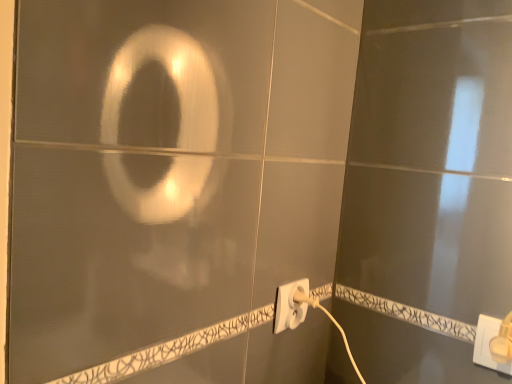
The width and height of the screenshot is (512, 384). What do you see at coordinates (488, 344) in the screenshot?
I see `white plastic power plug at lower right, the first power plugs and sockets positioned from the front` at bounding box center [488, 344].

Identify the location of white plastic power plug at lower right, positioned as the second power plugs and sockets in back-to-front order. (488, 344).

The image size is (512, 384). What do you see at coordinates (290, 305) in the screenshot?
I see `white plastic power plug at lower center, positioned as the second power plugs and sockets in right-to-left order` at bounding box center [290, 305].

You are a GUI agent. You are given a task and a screenshot of the screen. Output one action in this format:
    pyautogui.click(x=<x>, y=<y>)
    Task: Click on the white plastic power plug at lower center, the first power plugs and sockets in the left-to-right sequence
    
    Given the screenshot: What is the action you would take?
    [290, 305]

Locate an element on the screen. This screenshot has width=512, height=384. white plastic power plug at lower right, the second power plugs and sockets positioned from the left is located at coordinates (488, 344).

Would you say white plastic power plug at lower center, arranged as the second power plugs and sockets when viewed from the front, is to the left or to the right of white plastic power plug at lower right, acting as the first power plugs and sockets starting from the right, in the picture?

In the image, white plastic power plug at lower center, arranged as the second power plugs and sockets when viewed from the front, appears on the left side of white plastic power plug at lower right, acting as the first power plugs and sockets starting from the right.

Is white plastic power plug at lower center, positioned as the second power plugs and sockets in right-to-left order, in front of white plastic power plug at lower right, positioned as the second power plugs and sockets in back-to-front order?

That is False.

Is point (287, 309) less distant than point (490, 322)?

No, it is behind (490, 322).

From the image's perspective, does white plastic power plug at lower center, positioned as the second power plugs and sockets in right-to-left order, appear higher than white plastic power plug at lower right, the first power plugs and sockets positioned from the front?

Yes, from the image's perspective, white plastic power plug at lower center, positioned as the second power plugs and sockets in right-to-left order, is above white plastic power plug at lower right, the first power plugs and sockets positioned from the front.

From a real-world perspective, is white plastic power plug at lower center, the first power plugs and sockets in the left-to-right sequence, above or below white plastic power plug at lower right, positioned as the second power plugs and sockets in back-to-front order?

In terms of real-world spatial position, white plastic power plug at lower center, the first power plugs and sockets in the left-to-right sequence, is above white plastic power plug at lower right, positioned as the second power plugs and sockets in back-to-front order.

Which object is thinner, white plastic power plug at lower center, positioned as the second power plugs and sockets in right-to-left order, or white plastic power plug at lower right, positioned as the second power plugs and sockets in back-to-front order?

white plastic power plug at lower right, positioned as the second power plugs and sockets in back-to-front order.

Between white plastic power plug at lower center, which is the first power plugs and sockets from back to front, and white plastic power plug at lower right, acting as the first power plugs and sockets starting from the right, which one has more height?

With more height is white plastic power plug at lower center, which is the first power plugs and sockets from back to front.

Who is smaller, white plastic power plug at lower center, positioned as the second power plugs and sockets in right-to-left order, or white plastic power plug at lower right, the second power plugs and sockets positioned from the left?

Smaller between the two is white plastic power plug at lower right, the second power plugs and sockets positioned from the left.

Which is correct: white plastic power plug at lower center, the first power plugs and sockets in the left-to-right sequence, is inside white plastic power plug at lower right, the second power plugs and sockets positioned from the left, or outside of it?

white plastic power plug at lower center, the first power plugs and sockets in the left-to-right sequence, is outside white plastic power plug at lower right, the second power plugs and sockets positioned from the left.

Is white plastic power plug at lower center, which is the first power plugs and sockets from back to front, beside white plastic power plug at lower right, the first power plugs and sockets positioned from the front?

white plastic power plug at lower center, which is the first power plugs and sockets from back to front, and white plastic power plug at lower right, the first power plugs and sockets positioned from the front, are not in contact.

Is white plastic power plug at lower center, arranged as the second power plugs and sockets when viewed from the front, turned away from white plastic power plug at lower right, positioned as the second power plugs and sockets in back-to-front order?

white plastic power plug at lower center, arranged as the second power plugs and sockets when viewed from the front, is not turned away from white plastic power plug at lower right, positioned as the second power plugs and sockets in back-to-front order.

How much distance is there between white plastic power plug at lower center, which is the first power plugs and sockets from back to front, and white plastic power plug at lower right, the second power plugs and sockets positioned from the left?

white plastic power plug at lower center, which is the first power plugs and sockets from back to front, and white plastic power plug at lower right, the second power plugs and sockets positioned from the left, are 12.11 inches apart.

Locate an element on the screen. The image size is (512, 384). power plugs and sockets that is behind the white plastic power plug at lower right, the first power plugs and sockets positioned from the front is located at coordinates (290, 305).

Which object is positioned more to the right, white plastic power plug at lower right, acting as the first power plugs and sockets starting from the right, or white plastic power plug at lower center, which is the first power plugs and sockets from back to front?

Positioned to the right is white plastic power plug at lower right, acting as the first power plugs and sockets starting from the right.

Relative to white plastic power plug at lower center, positioned as the second power plugs and sockets in right-to-left order, is white plastic power plug at lower right, the first power plugs and sockets positioned from the front, in front or behind?

white plastic power plug at lower right, the first power plugs and sockets positioned from the front, is positioned closer to the viewer than white plastic power plug at lower center, positioned as the second power plugs and sockets in right-to-left order.

Is point (501, 371) closer to camera compared to point (278, 320)?

Yes, point (501, 371) is closer to viewer.

From the image's perspective, would you say white plastic power plug at lower right, acting as the first power plugs and sockets starting from the right, is positioned over white plastic power plug at lower center, which is the first power plugs and sockets from back to front?

No, from the image's perspective, white plastic power plug at lower right, acting as the first power plugs and sockets starting from the right, is not over white plastic power plug at lower center, which is the first power plugs and sockets from back to front.

From a real-world perspective, is white plastic power plug at lower right, acting as the first power plugs and sockets starting from the right, positioned above or below white plastic power plug at lower center, positioned as the second power plugs and sockets in right-to-left order?

white plastic power plug at lower right, acting as the first power plugs and sockets starting from the right, is situated lower than white plastic power plug at lower center, positioned as the second power plugs and sockets in right-to-left order, in the real world.

Which of these two, white plastic power plug at lower right, the second power plugs and sockets positioned from the left, or white plastic power plug at lower center, which is the first power plugs and sockets from back to front, is wider?

white plastic power plug at lower center, which is the first power plugs and sockets from back to front.

Does white plastic power plug at lower right, acting as the first power plugs and sockets starting from the right, have a lesser height compared to white plastic power plug at lower center, which is the first power plugs and sockets from back to front?

Yes, white plastic power plug at lower right, acting as the first power plugs and sockets starting from the right, is shorter than white plastic power plug at lower center, which is the first power plugs and sockets from back to front.

Based on the photo, which of these two, white plastic power plug at lower right, the first power plugs and sockets positioned from the front, or white plastic power plug at lower center, arranged as the second power plugs and sockets when viewed from the front, is smaller?

white plastic power plug at lower right, the first power plugs and sockets positioned from the front.

Is white plastic power plug at lower center, the first power plugs and sockets in the left-to-right sequence, surrounded by white plastic power plug at lower right, the second power plugs and sockets positioned from the left?

That's incorrect, white plastic power plug at lower center, the first power plugs and sockets in the left-to-right sequence, is not inside white plastic power plug at lower right, the second power plugs and sockets positioned from the left.

Based on the photo, can you see white plastic power plug at lower right, the second power plugs and sockets positioned from the left, touching white plastic power plug at lower center, arranged as the second power plugs and sockets when viewed from the front?

white plastic power plug at lower right, the second power plugs and sockets positioned from the left, and white plastic power plug at lower center, arranged as the second power plugs and sockets when viewed from the front, are clearly separated.

Is white plastic power plug at lower right, positioned as the second power plugs and sockets in back-to-front order, turned away from white plastic power plug at lower center, the first power plugs and sockets in the left-to-right sequence?

No, white plastic power plug at lower right, positioned as the second power plugs and sockets in back-to-front order, is not facing the opposite direction of white plastic power plug at lower center, the first power plugs and sockets in the left-to-right sequence.

The width and height of the screenshot is (512, 384). I want to click on power plugs and sockets above the white plastic power plug at lower right, the first power plugs and sockets positioned from the front (from a real-world perspective), so click(290, 305).

Image resolution: width=512 pixels, height=384 pixels. I want to click on power plugs and sockets in front of the white plastic power plug at lower center, positioned as the second power plugs and sockets in right-to-left order, so click(488, 344).

Where is `power plugs and sockets above the white plastic power plug at lower right, the second power plugs and sockets positioned from the left (from a real-world perspective)`? power plugs and sockets above the white plastic power plug at lower right, the second power plugs and sockets positioned from the left (from a real-world perspective) is located at coordinates (290, 305).